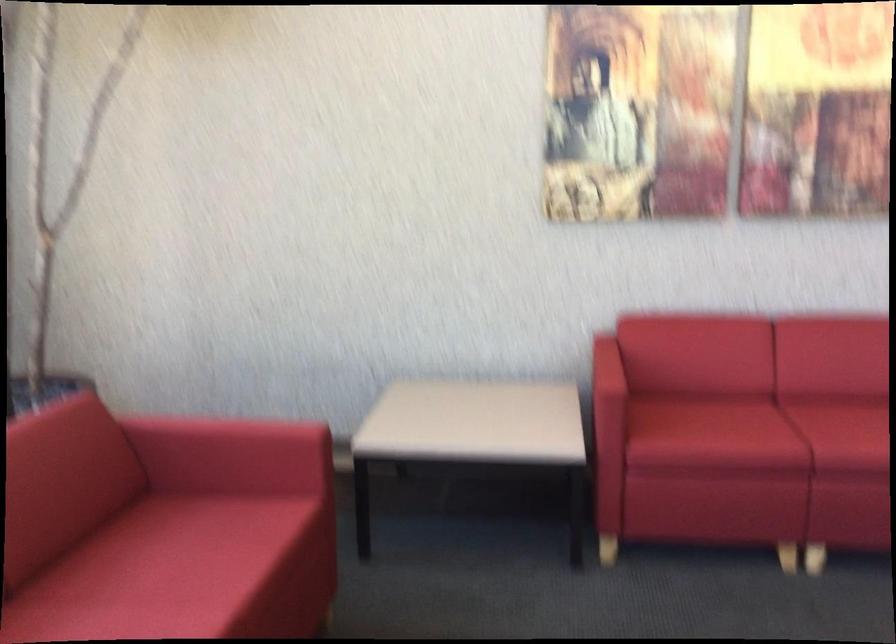
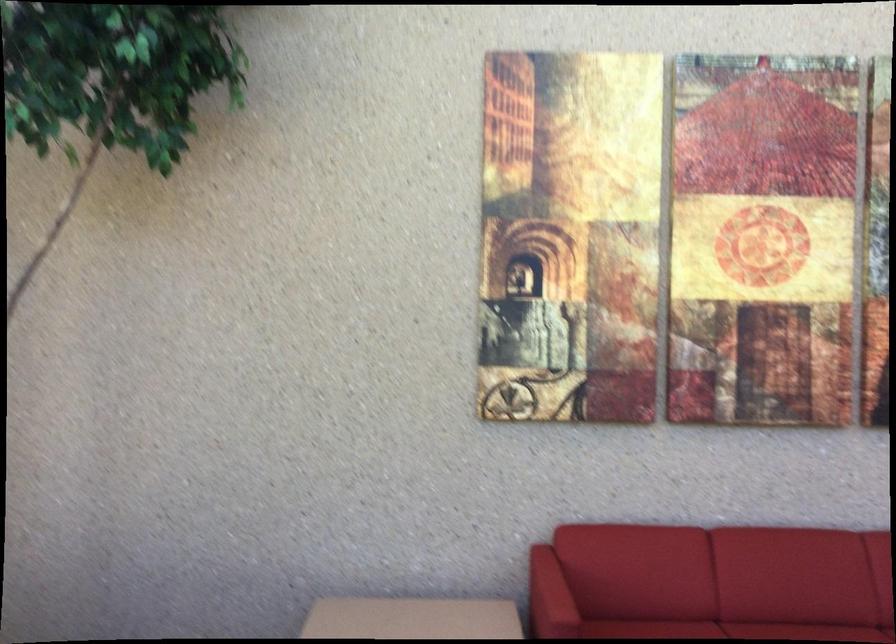
Where in the second image is the point corresponding to pixel 780 408 from the first image?

(727, 630)